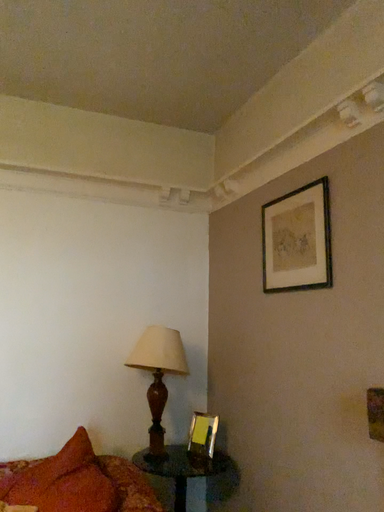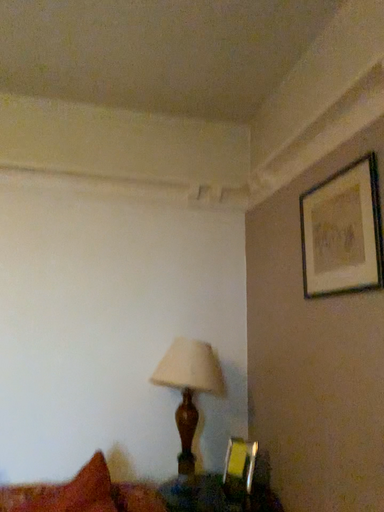
Question: How did the camera likely rotate when shooting the video?

Choices:
 (A) rotated right
 (B) rotated left

Answer: (B)